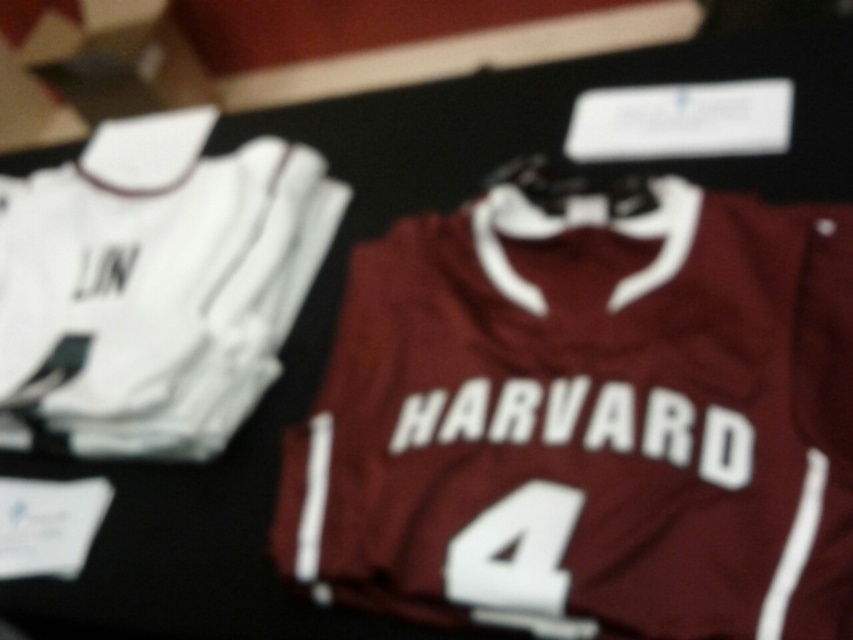
Question: Is maroon jersey at right smaller than white fabric number at center?

Choices:
 (A) no
 (B) yes

Answer: (A)

Question: Is maroon jersey at right positioned in front of white fabric number at center?

Choices:
 (A) yes
 (B) no

Answer: (A)

Question: Which point is farther to the camera?

Choices:
 (A) white jersey at left
 (B) white fabric number at center
 (C) maroon jersey at right

Answer: (A)

Question: Which point appears closest to the camera in this image?

Choices:
 (A) (824, 352)
 (B) (582, 496)
 (C) (119, 371)

Answer: (B)

Question: Can you confirm if white jersey at left is positioned to the right of white fabric number at center?

Choices:
 (A) no
 (B) yes

Answer: (A)

Question: Which of the following is the farthest from the observer?

Choices:
 (A) (109, 428)
 (B) (579, 500)
 (C) (357, 433)

Answer: (A)